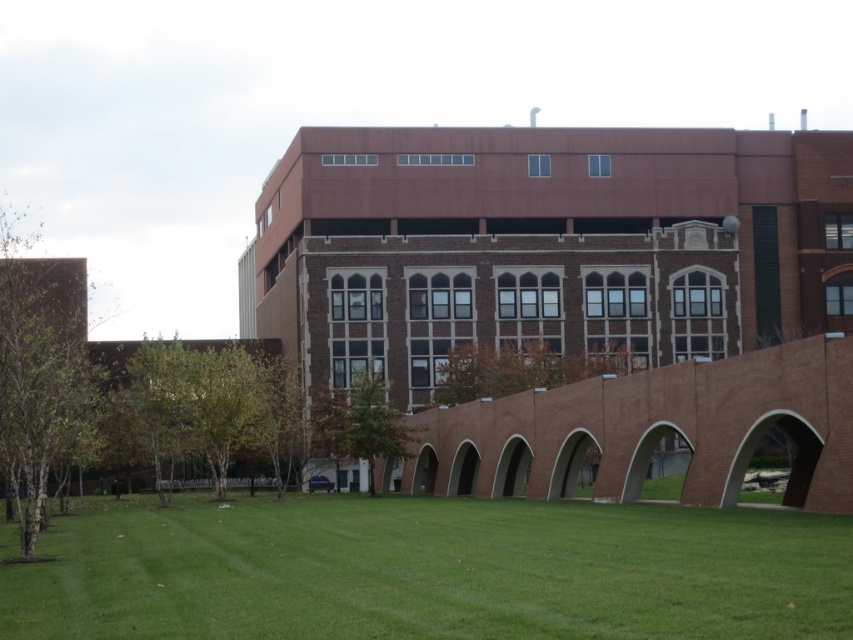
Looking at this image, you are standing in front of the building and want to walk from the green leafy tree at left to the green leafy tree at center. Which direction should you face to walk directly towards the second tree?

You should face to the right because the green leafy tree at left is to the left of the green leafy tree at center, so moving towards the right will lead you directly to the second tree.

You are standing in front of the building and want to walk from the green leafy tree at left to the green grass at lower center. Which direction should you move?

You should move to the right because the green grass at lower center is located to the right of the green leafy tree at left.

You are standing in front of the building and want to walk towards the green grass at lower center. Based on the 2D coordinates provided, in which direction should you move relative to your current position?

The green grass at lower center is located at coordinates approximately 0.895 on the x and 0.508 on the y axis. Since the lower center position has a higher x value, you should move towards the right direction relative to your current position facing the building.